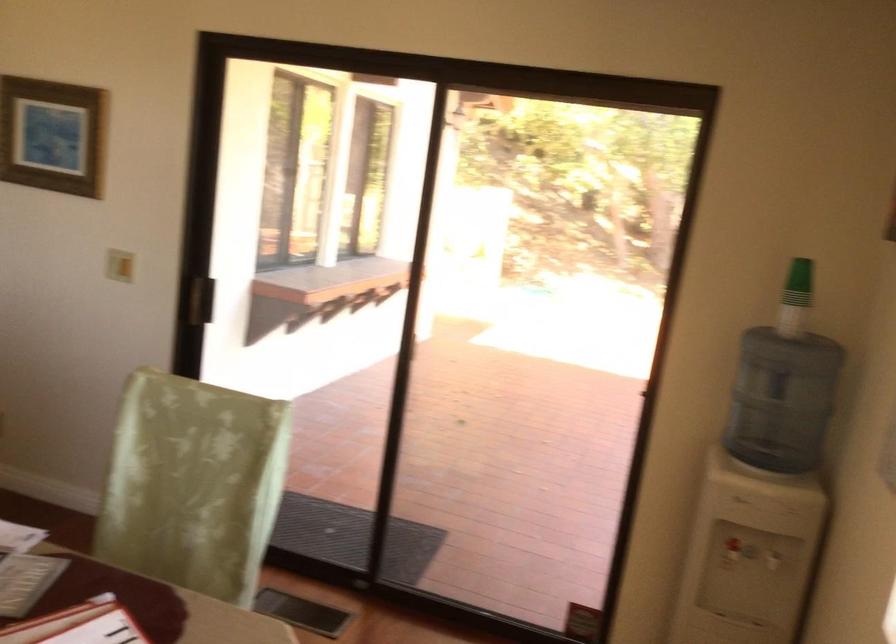
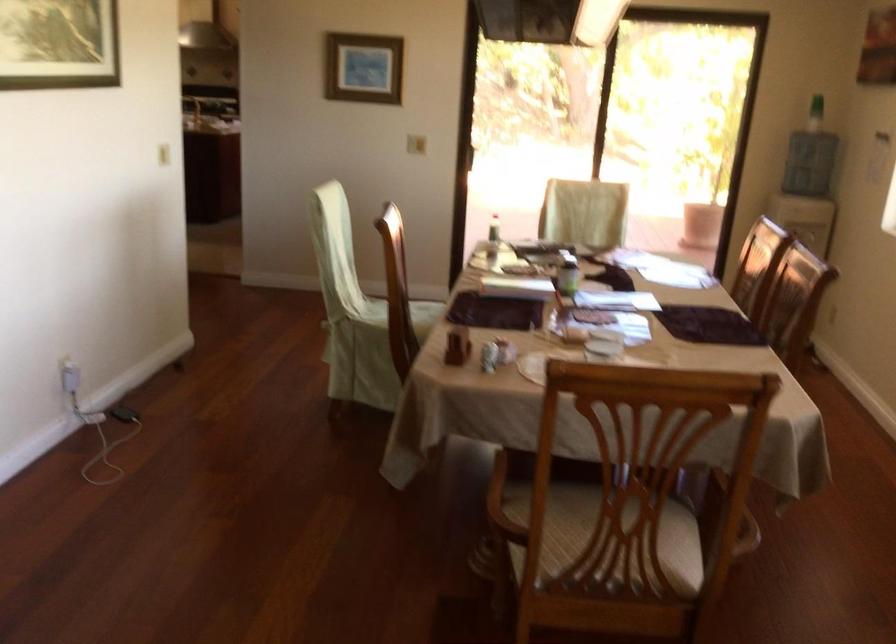
Question: I am providing you with two images of the same scene from different viewpoints. Please identify which objects are invisible in image2.

Choices:
 (A) red dispenser tap
 (B) red lamp head
 (C) white power adapter
 (D) bottle with red top

Answer: (A)